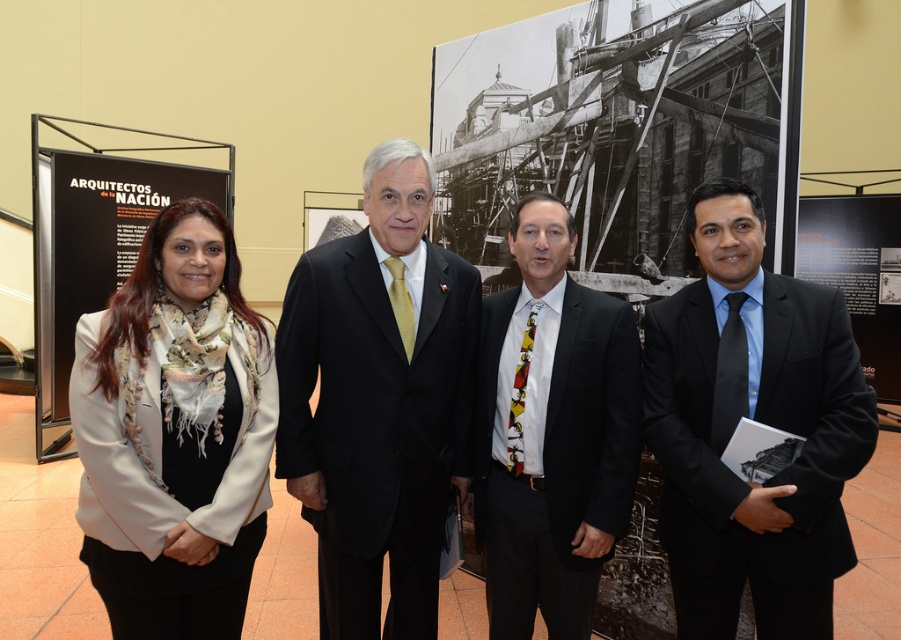
You are a photographer at the event and need to capture a closeup of both the black satin suit at center and the white textured scarf at left. Given their sizes, which one should you focus on first to ensure proper framing?

The black satin suit at center is larger in size than the white textured scarf at left, so you should focus on the black satin suit at center first to ensure proper framing due to its larger size.

You are an event organizer at the gallery and need to adjust the seating arrangement for a panel discussion. The two individuals in the black satin suit at center and black silk suit at center are both speakers. Which speaker is standing closer to the floor?

The black satin suit at center is positioned under the black silk suit at center, so the speaker in the black satin suit at center is standing closer to the floor.